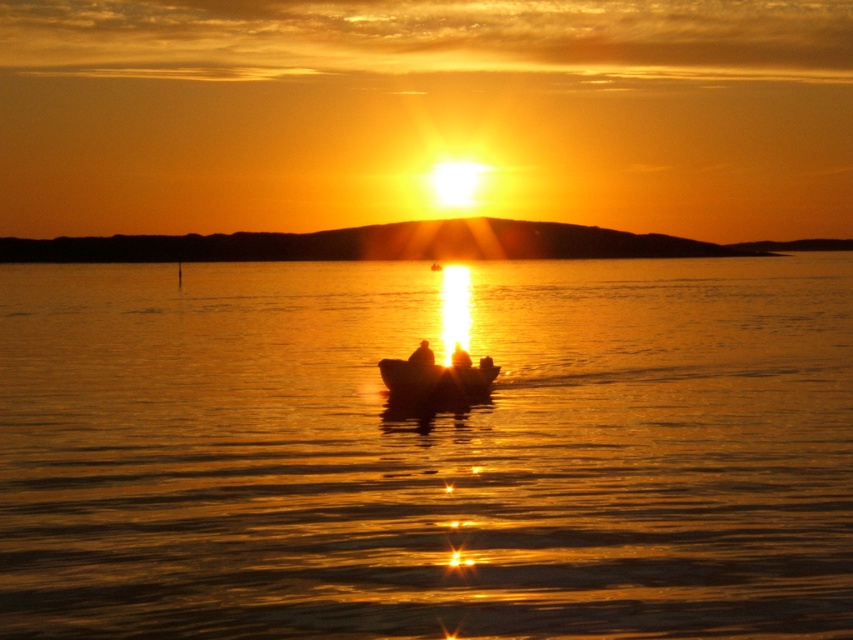
You are standing on the shore observing the sunset scene. You notice the glistening golden water at center and the smooth skin figure at center. Which object is positioned to the right of the other?

The glistening golden water at center is to the right of smooth skin figure at center.

You are standing on the shore of the lake and see the point marked at coordinates (434, 381). What object is located at that point?

The smooth wooden boat at center is located at the point marked at coordinates (434, 381).